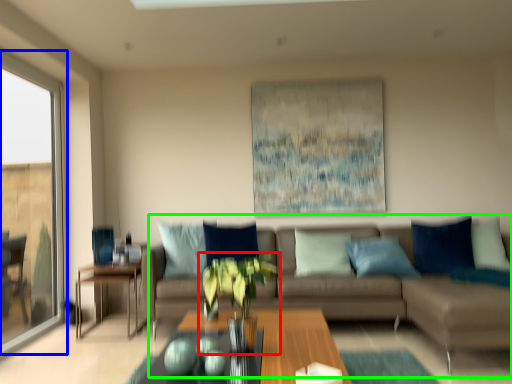
Question: Which object is positioned closest to houseplant (highlighted by a red box)? Select from window (highlighted by a blue box) and studio couch (highlighted by a green box).

Choices:
 (A) window
 (B) studio couch

Answer: (B)